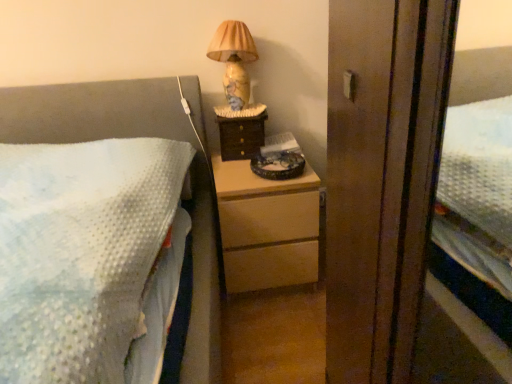
Question: Considering the positions of light wood chest of drawers at center and wooden drawer at center in the image, is light wood chest of drawers at center wider or thinner than wooden drawer at center?

Choices:
 (A) wide
 (B) thin

Answer: (A)

Question: Is point coord(279,284) positioned closer to the camera than point coord(238,145)?

Choices:
 (A) closer
 (B) farther

Answer: (A)

Question: Based on their relative distances, which object is farther from the light wood chest of drawers at center?

Choices:
 (A) marble-patterned lampshade at upper right
 (B) wooden drawer at center

Answer: (A)

Question: Which of these objects is positioned farthest from the marble-patterned lampshade at upper right?

Choices:
 (A) wooden drawer at center
 (B) light wood chest of drawers at center

Answer: (B)